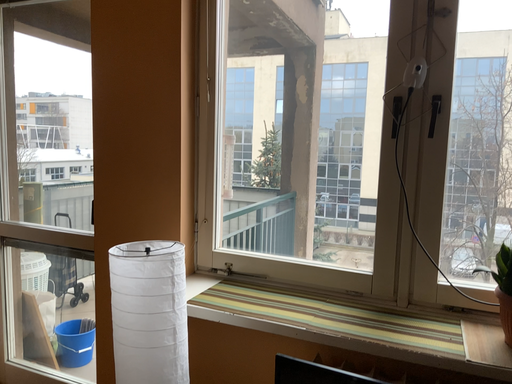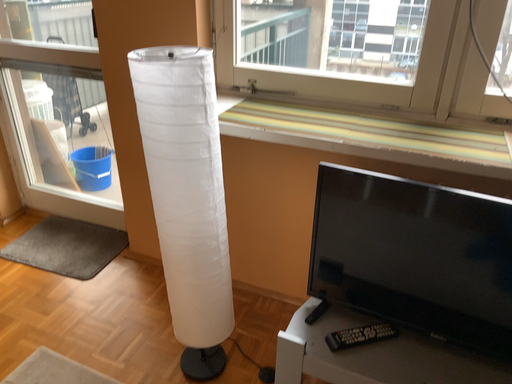
Question: Which way did the camera rotate in the video?

Choices:
 (A) rotated upward
 (B) rotated downward

Answer: (B)